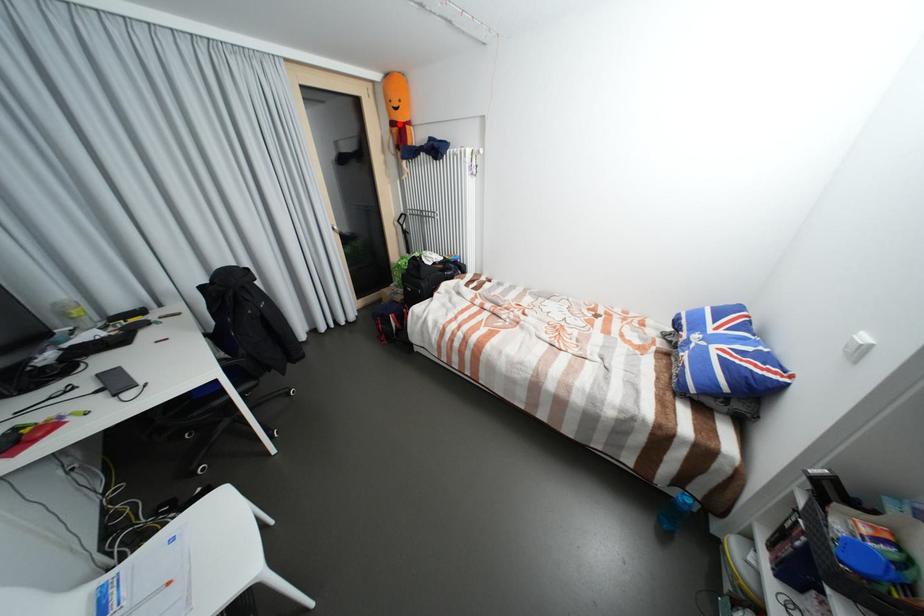
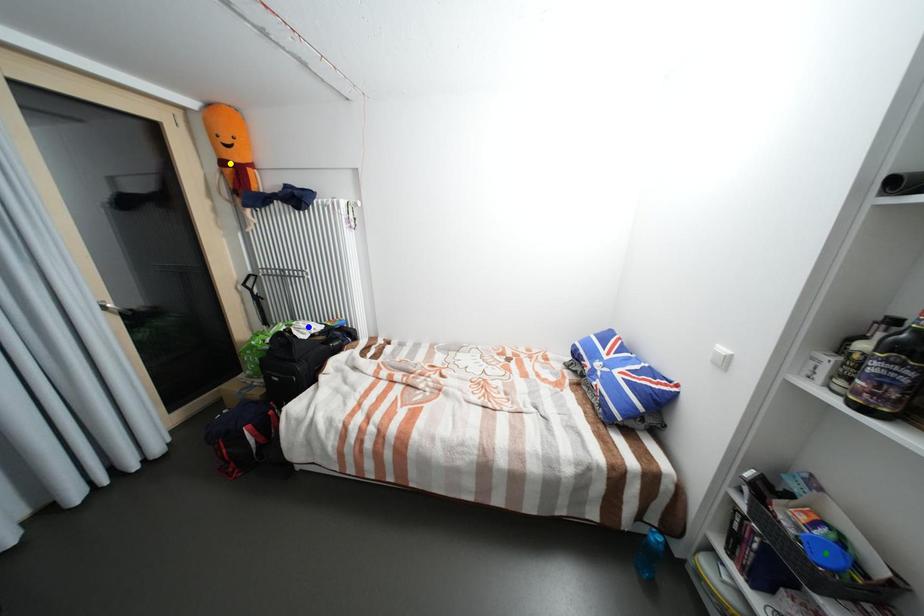
Question: I am providing you with two images of the same scene from different viewpoints. A red point is marked on the first image. You are given multiple points on the second image. Which mark in image 2 goes with the point in image 1?

Choices:
 (A) green point
 (B) blue point
 (C) yellow point

Answer: (C)